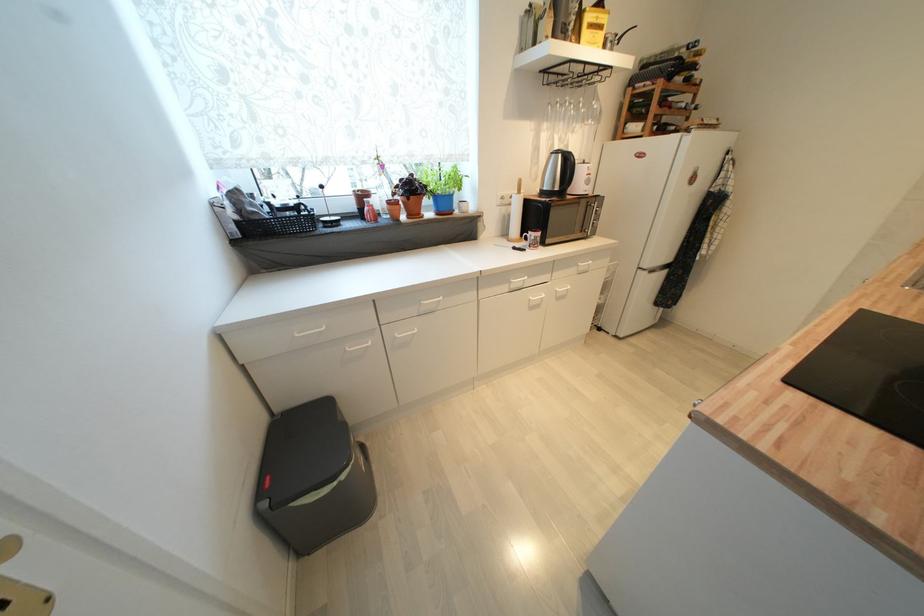
The height and width of the screenshot is (616, 924). Identify the location of kettle handle. (569, 180).